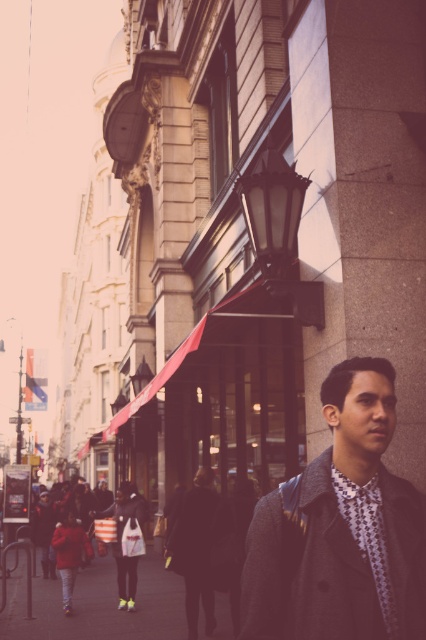
Who is shorter, dark gray wool coat at center or red wool coat at lower left?

With less height is red wool coat at lower left.

Which is above, dark gray wool coat at center or red wool coat at lower left?

dark gray wool coat at center is above.

Is point (196, 563) positioned behind point (83, 552)?

No, (196, 563) is closer to viewer.

The height and width of the screenshot is (640, 426). I want to click on dark gray wool coat at center, so click(198, 532).

Which is more to the left, dark gray woolen jacket at lower right or dark gray wool coat at center?

Positioned to the left is dark gray wool coat at center.

Between point (267, 560) and point (190, 560), which one is positioned in front?

Positioned in front is point (267, 560).

The height and width of the screenshot is (640, 426). In order to click on dark gray woolen jacket at lower right in this screenshot , I will do `click(307, 566)`.

Measure the distance from dark gray woolen jacket at lower right to red wool coat at lower left.

dark gray woolen jacket at lower right and red wool coat at lower left are 31.23 meters apart from each other.

The image size is (426, 640). Describe the element at coordinates (307, 566) in the screenshot. I see `dark gray woolen jacket at lower right` at that location.

In order to click on dark gray woolen jacket at lower right in this screenshot , I will do `click(307, 566)`.